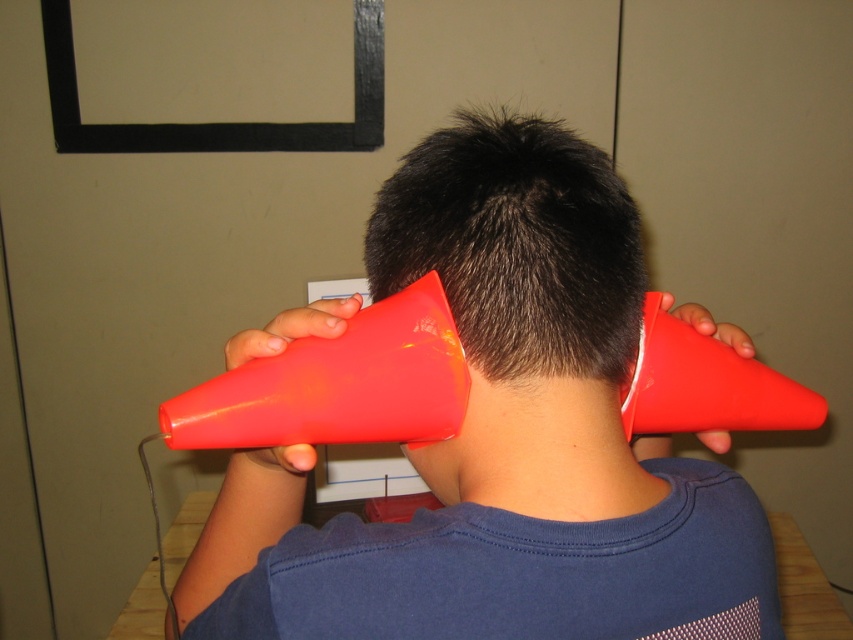
Question: Is glossy plastic cones at upper center in front of dark matte hair at center?

Choices:
 (A) no
 (B) yes

Answer: (B)

Question: Which point appears closest to the camera in this image?

Choices:
 (A) (544, 353)
 (B) (537, 156)

Answer: (A)

Question: Can you confirm if glossy plastic cones at upper center is positioned to the left of dark matte hair at center?

Choices:
 (A) no
 (B) yes

Answer: (A)

Question: Which point is closer to the camera taking this photo?

Choices:
 (A) (537, 212)
 (B) (524, 440)

Answer: (A)

Question: Is glossy plastic cones at upper center closer to camera compared to dark matte hair at center?

Choices:
 (A) yes
 (B) no

Answer: (A)